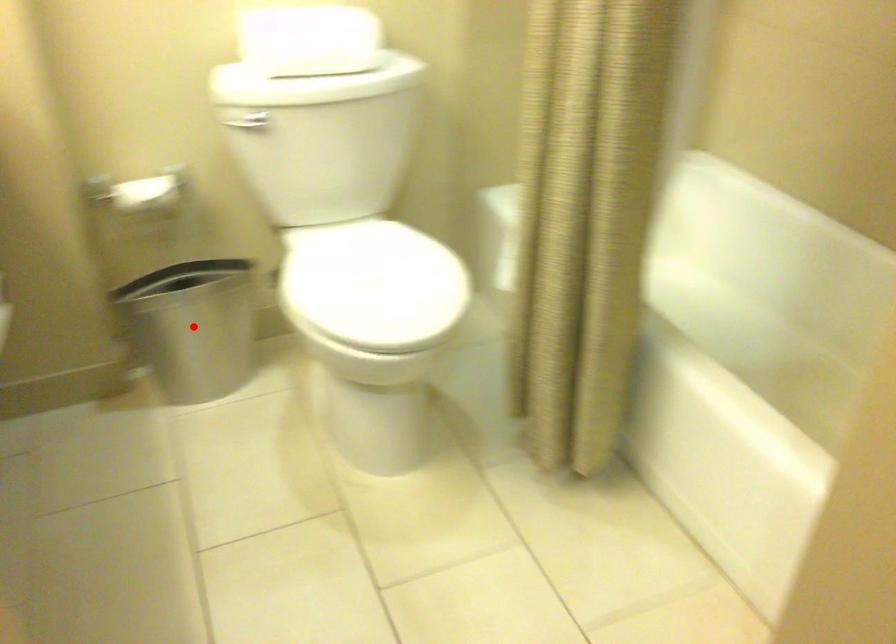
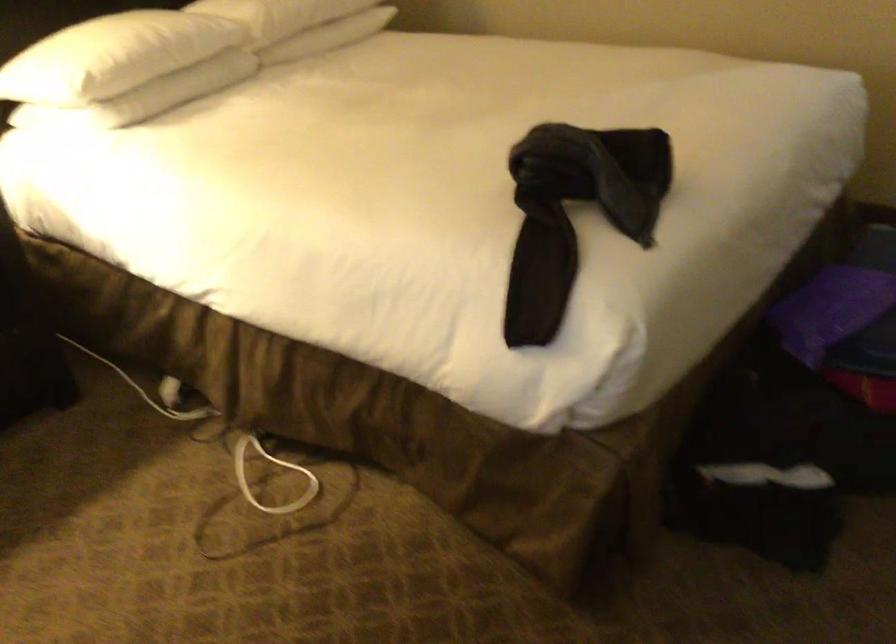
Question: I am providing you with two images of the same scene from different viewpoints. A red point is marked on the first image. Can you still see the location of the red point in image 2?

Choices:
 (A) Yes
 (B) No

Answer: (B)